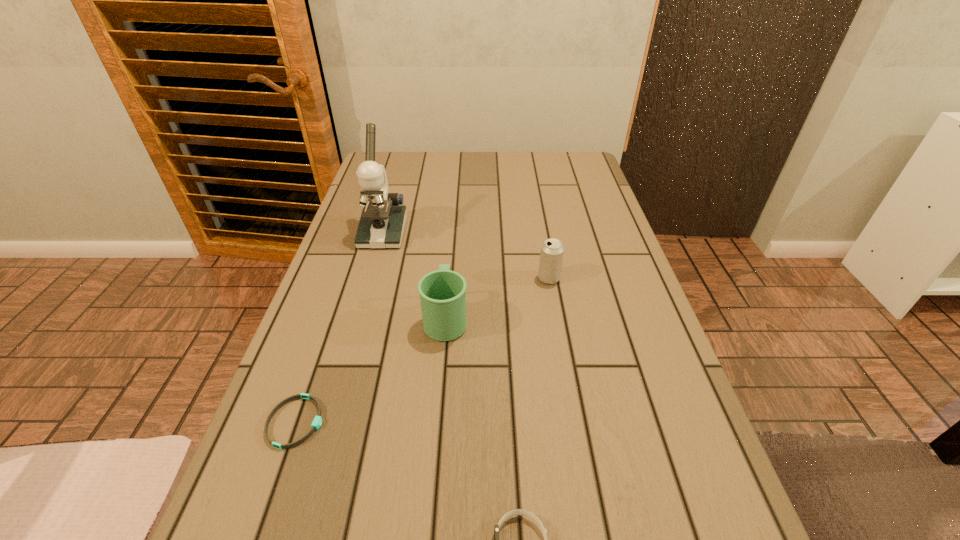
This screenshot has width=960, height=540. I want to click on free spot at the far right corner of the desktop, so click(580, 165).

Image resolution: width=960 pixels, height=540 pixels. What are the coordinates of `free space between the third object from left to right and the shorter wristband` in the screenshot? It's located at (371, 370).

Image resolution: width=960 pixels, height=540 pixels. Identify the location of free point between the mug and the farthest object. (414, 276).

This screenshot has height=540, width=960. I want to click on free spot between the farthest object and the fourth nearest object, so click(x=466, y=256).

Identify the location of blank region between the farthest object and the rightmost object. This screenshot has height=540, width=960. (466, 256).

You are a GUI agent. You are given a task and a screenshot of the screen. Output one action in this format:
    pyautogui.click(x=<x>, y=<y>)
    Task: Click on the vacant area that lies between the mug and the beer can
    This screenshot has width=960, height=540.
    Given the screenshot: What is the action you would take?
    pyautogui.click(x=497, y=298)

Where is `vacant area between the fourth nearest object and the left wristband`? The image size is (960, 540). vacant area between the fourth nearest object and the left wristband is located at coordinates (422, 350).

Select which object appears as the second closest to the farthest object. Please provide its 2D coordinates. Your answer should be formatted as a tuple, i.e. [(x, y)], where the tuple contains the x and y coordinates of a point satisfying the conditions above.

[(551, 256)]

Identify which object is located as the nearest to the nearest object. Please provide its 2D coordinates. Your answer should be formatted as a tuple, i.e. [(x, y)], where the tuple contains the x and y coordinates of a point satisfying the conditions above.

[(316, 424)]

Identify the location of vacant point that satisfies the following two spatial constraints: 1. on the side of the third nearest object with the handle; 2. on the right side of the rightmost object. The image size is (960, 540). (449, 278).